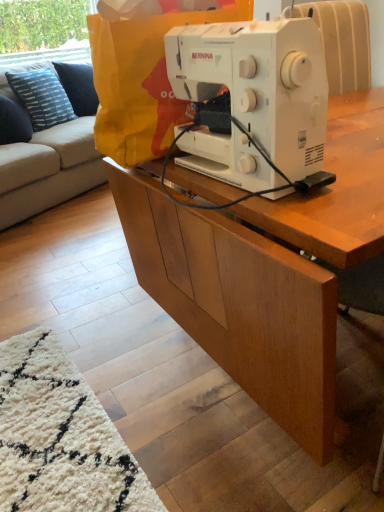
At what (x,y) coordinates should I click in order to perform the action: click on free region under white plastic sewing machine at center (from a real-world perspective). Please return your answer as a coordinate pair (x, y). Looking at the image, I should click on pos(228,389).